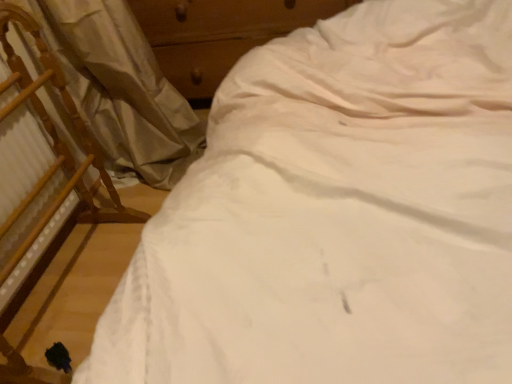
Question: Is wooden chair at left wider or thinner than white fabric curtain at left?

Choices:
 (A) thin
 (B) wide

Answer: (A)

Question: Is point (29, 134) closer or farther from the camera than point (179, 140)?

Choices:
 (A) closer
 (B) farther

Answer: (A)

Question: Which of these objects is positioned closest to the white fabric curtain at left?

Choices:
 (A) wooden dresser at upper center
 (B) wooden chair at left

Answer: (B)

Question: Based on their relative distances, which object is nearer to the wooden chair at left?

Choices:
 (A) white fabric curtain at left
 (B) wooden dresser at upper center

Answer: (A)